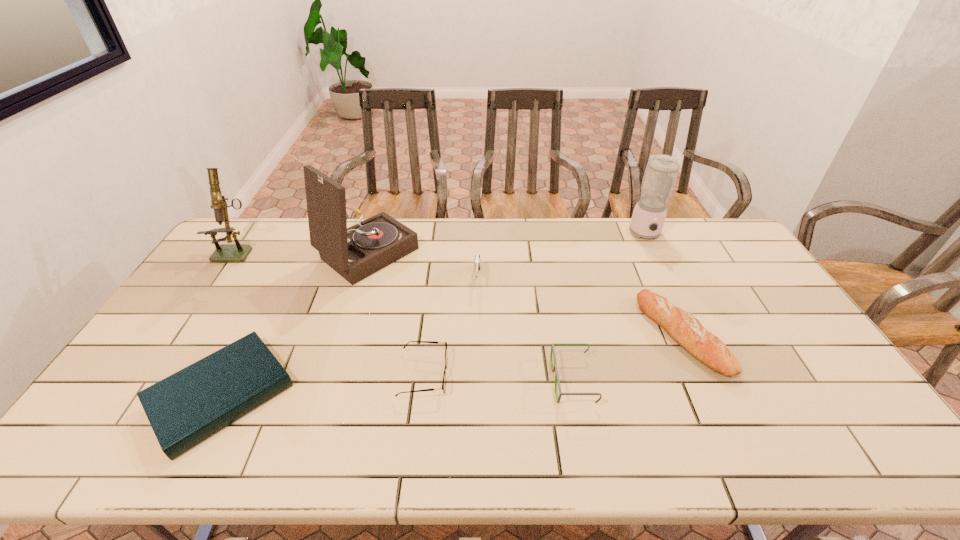
Find the location of a particular element. food processor located in the far edge section of the desktop is located at coordinates (661, 172).

At what (x,y) coordinates should I click in order to perform the action: click on microscope present at the far edge. Please return your answer as a coordinate pair (x, y). Looking at the image, I should click on (237, 252).

This screenshot has width=960, height=540. What are the coordinates of `object located at the near edge` in the screenshot? It's located at (184, 409).

The image size is (960, 540). What are the coordinates of `microscope that is at the left edge` in the screenshot? It's located at (237, 252).

Locate an element on the screen. book present at the left edge is located at coordinates (184, 409).

Identify the location of object that is at the far left corner. (237, 252).

Locate an element on the screen. object present at the near left corner is located at coordinates (184, 409).

Locate an element on the screen. This screenshot has height=540, width=960. vacant space at the far edge of the desktop is located at coordinates (422, 218).

Identify the location of vacant space at the near edge of the desktop. This screenshot has width=960, height=540. (656, 431).

What are the coordinates of `vacant space at the left edge` in the screenshot? It's located at (229, 302).